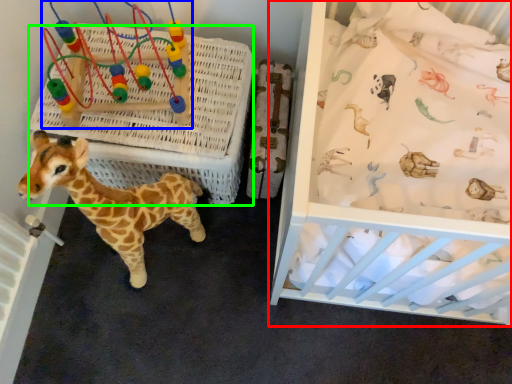
Question: Considering the real-world distances, which object is closest to infant bed (highlighted by a red box)? toy (highlighted by a blue box) or crate (highlighted by a green box).

Choices:
 (A) toy
 (B) crate

Answer: (B)